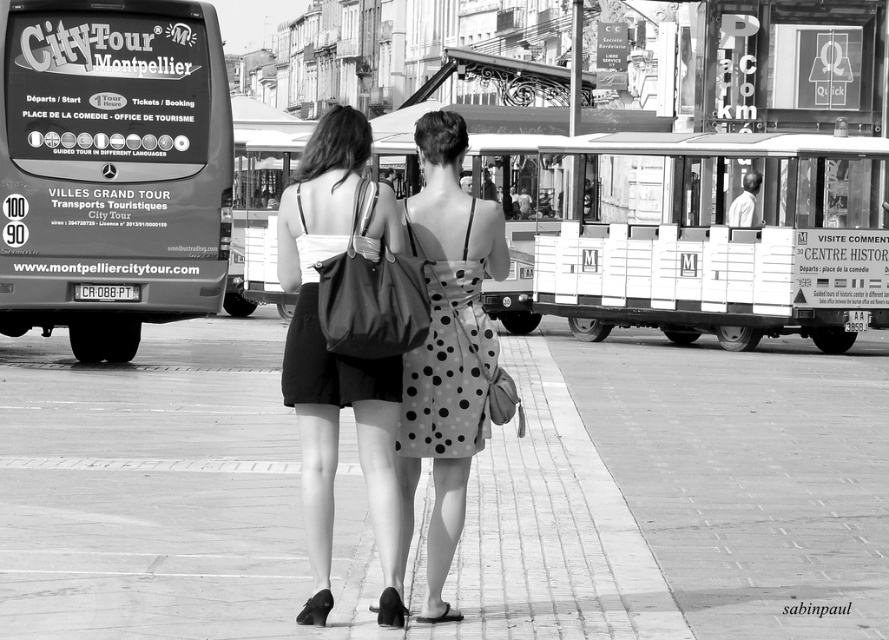
Question: Which of these objects is positioned farthest from the polka dot fabric dress at center?

Choices:
 (A) matte black dress at center
 (B) smooth concrete pavement at center

Answer: (B)

Question: Observing the image, what is the correct spatial positioning of smooth concrete pavement at center in reference to polka dot fabric dress at center?

Choices:
 (A) above
 (B) below

Answer: (B)

Question: Considering the relative positions of smooth concrete pavement at center and matte black dress at center in the image provided, where is smooth concrete pavement at center located with respect to matte black dress at center?

Choices:
 (A) above
 (B) below

Answer: (B)

Question: Which point is closer to the camera?

Choices:
 (A) (469, 253)
 (B) (23, 602)

Answer: (B)

Question: Which object is positioned closest to the smooth concrete pavement at center?

Choices:
 (A) matte black dress at center
 (B) polka dot fabric dress at center

Answer: (A)

Question: Can you confirm if smooth concrete pavement at center is positioned below polka dot fabric dress at center?

Choices:
 (A) no
 (B) yes

Answer: (B)